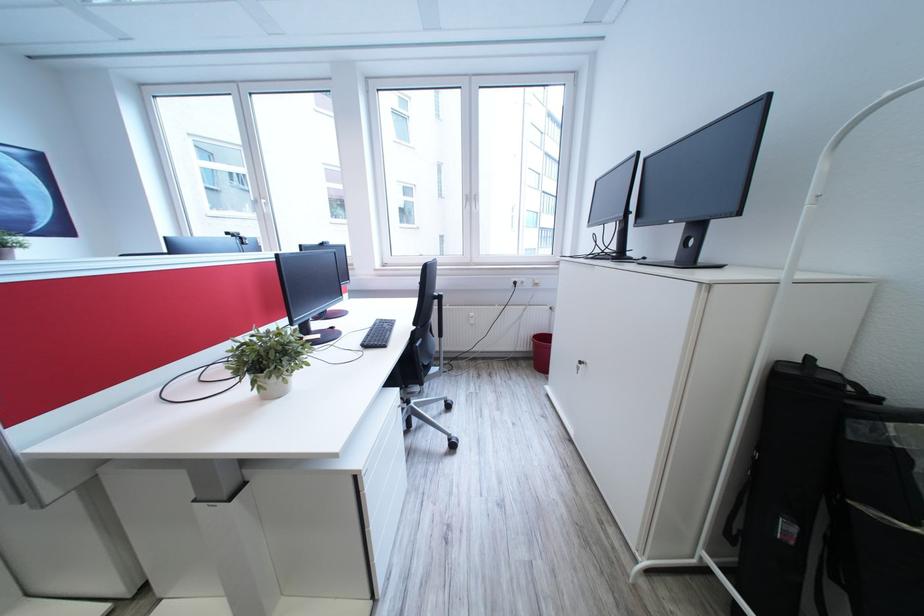
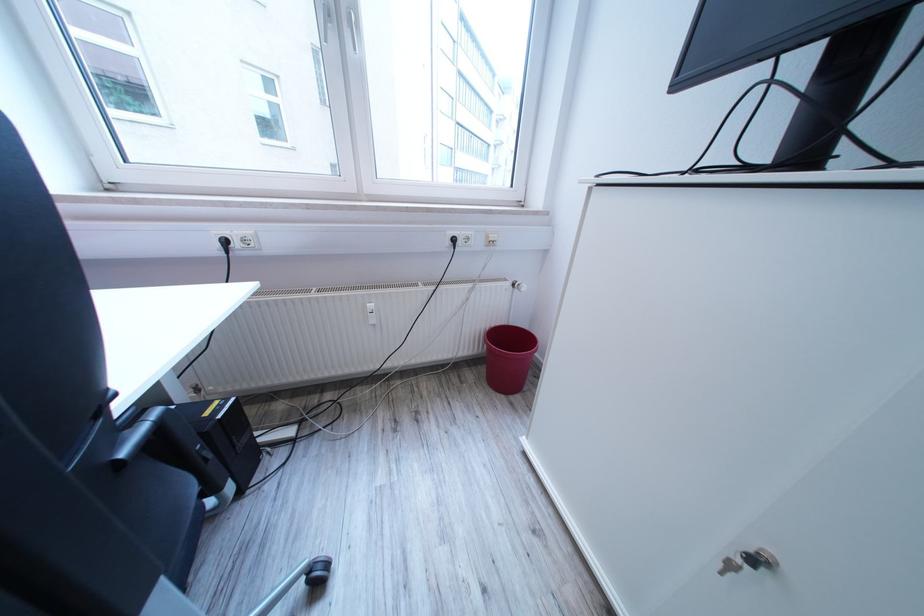
Question: What movement of the cameraman would produce the second image?

Choices:
 (A) Left
 (B) Right
 (C) Forward
 (D) Backward

Answer: (C)